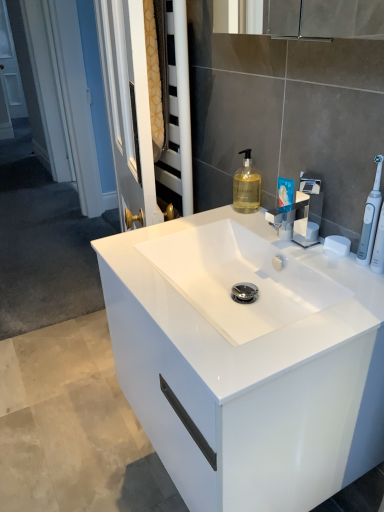
Where is `free space in front of satin nickel faucet at center`? free space in front of satin nickel faucet at center is located at coordinates (334, 283).